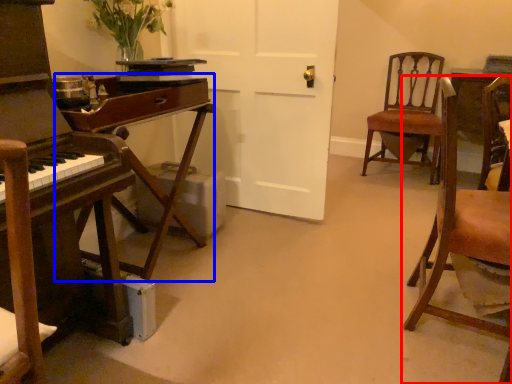
Question: Which of the following is the farthest to the observer, chair (highlighted by a red box) or table (highlighted by a blue box)?

Choices:
 (A) chair
 (B) table

Answer: (B)